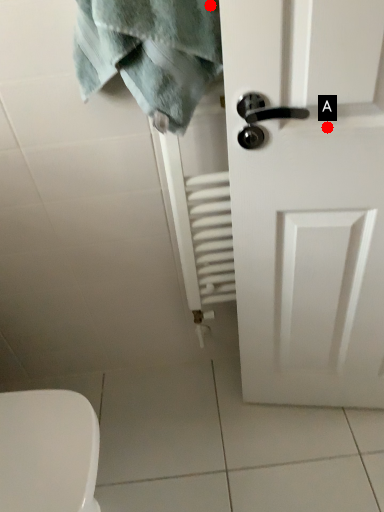
Question: Two points are circled on the image, labeled by A and B beside each circle. Which of the following is the farthest from the observer?

Choices:
 (A) A is further
 (B) B is further

Answer: (A)